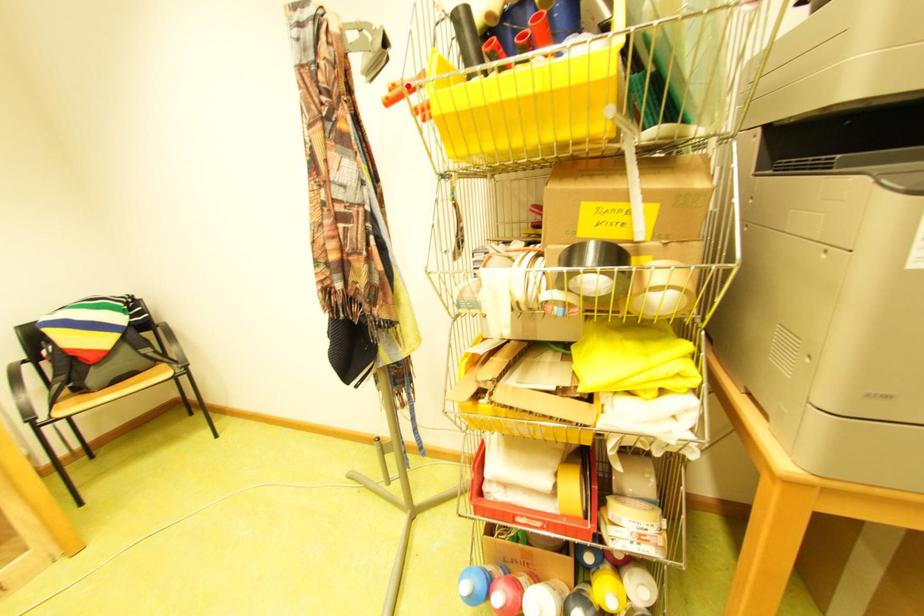
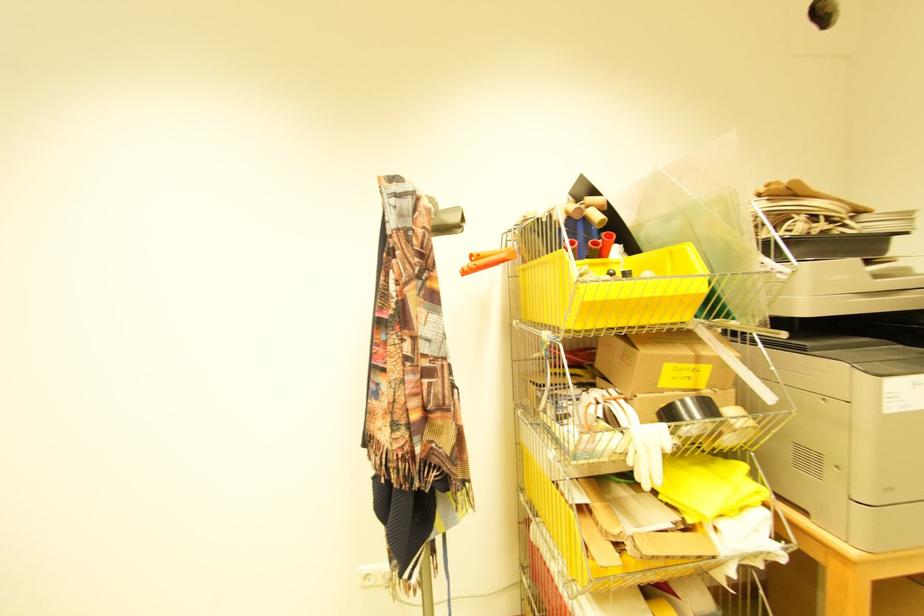
Find the pixel in the second image that matches the highlighted location in the first image.

(492, 254)